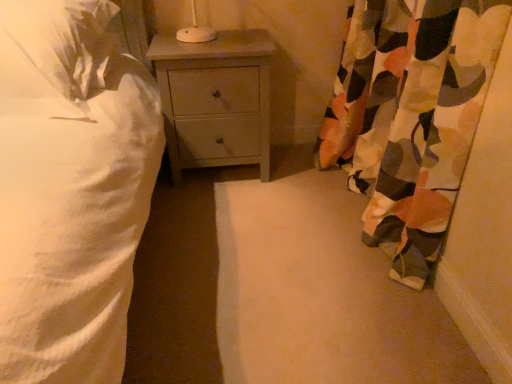
Question: Is camouflage fabric curtain at right shorter than white soft pillow at upper left?

Choices:
 (A) yes
 (B) no

Answer: (B)

Question: Is camouflage fabric curtain at right taller than white soft pillow at upper left?

Choices:
 (A) no
 (B) yes

Answer: (B)

Question: Considering the relative sizes of camouflage fabric curtain at right and white soft pillow at upper left in the image provided, is camouflage fabric curtain at right bigger than white soft pillow at upper left?

Choices:
 (A) no
 (B) yes

Answer: (B)

Question: Can you confirm if camouflage fabric curtain at right is wider than white soft pillow at upper left?

Choices:
 (A) yes
 (B) no

Answer: (B)

Question: Does camouflage fabric curtain at right lie in front of white soft pillow at upper left?

Choices:
 (A) yes
 (B) no

Answer: (A)

Question: From a real-world perspective, is camouflage fabric curtain at right on top of white soft pillow at upper left?

Choices:
 (A) no
 (B) yes

Answer: (A)

Question: Is camouflage fabric curtain at right positioned before light gray wood nightstand at center?

Choices:
 (A) yes
 (B) no

Answer: (A)

Question: From the image's perspective, would you say camouflage fabric curtain at right is shown under light gray wood nightstand at center?

Choices:
 (A) no
 (B) yes

Answer: (B)

Question: Is camouflage fabric curtain at right looking in the opposite direction of light gray wood nightstand at center?

Choices:
 (A) yes
 (B) no

Answer: (B)

Question: Does camouflage fabric curtain at right have a greater height compared to light gray wood nightstand at center?

Choices:
 (A) no
 (B) yes

Answer: (B)

Question: Is camouflage fabric curtain at right not close to light gray wood nightstand at center?

Choices:
 (A) yes
 (B) no

Answer: (B)

Question: Considering the relative sizes of camouflage fabric curtain at right and light gray wood nightstand at center in the image provided, is camouflage fabric curtain at right shorter than light gray wood nightstand at center?

Choices:
 (A) yes
 (B) no

Answer: (B)

Question: From the image's perspective, is white soft pillow at upper left beneath light gray wood nightstand at center?

Choices:
 (A) yes
 (B) no

Answer: (B)